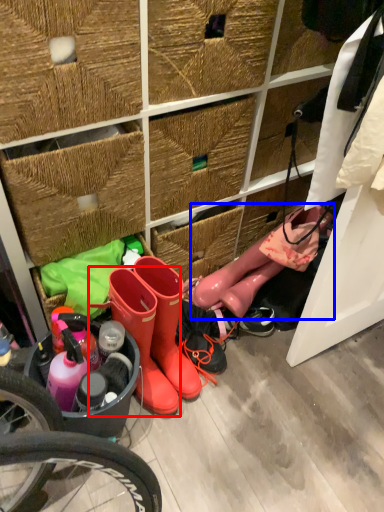
Question: Which object appears closest to the camera in this image, footwear (highlighted by a red box) or footwear (highlighted by a blue box)?

Choices:
 (A) footwear
 (B) footwear

Answer: (A)